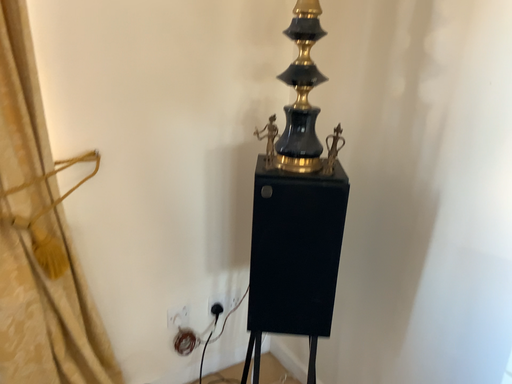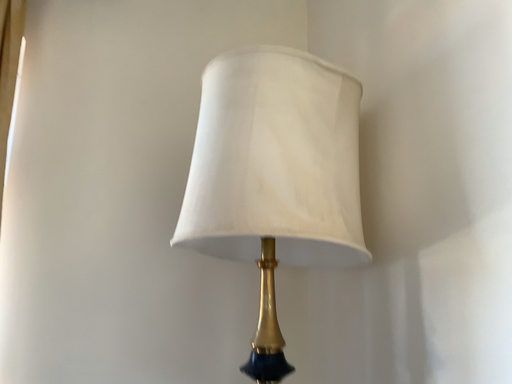
Question: How did the camera likely rotate when shooting the video?

Choices:
 (A) rotated downward
 (B) rotated upward

Answer: (B)